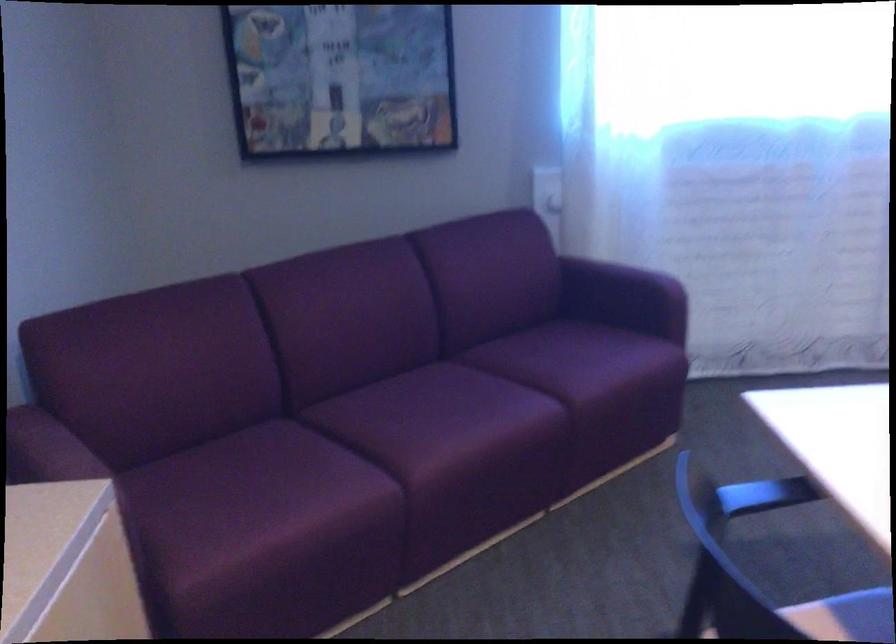
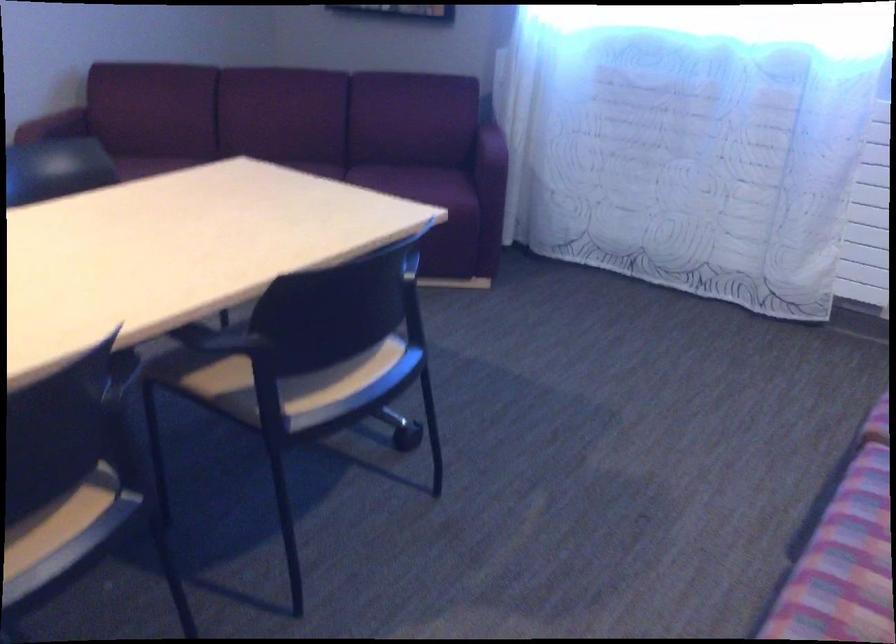
The point at (633, 348) is marked in the first image. Where is the corresponding point in the second image?

(426, 183)